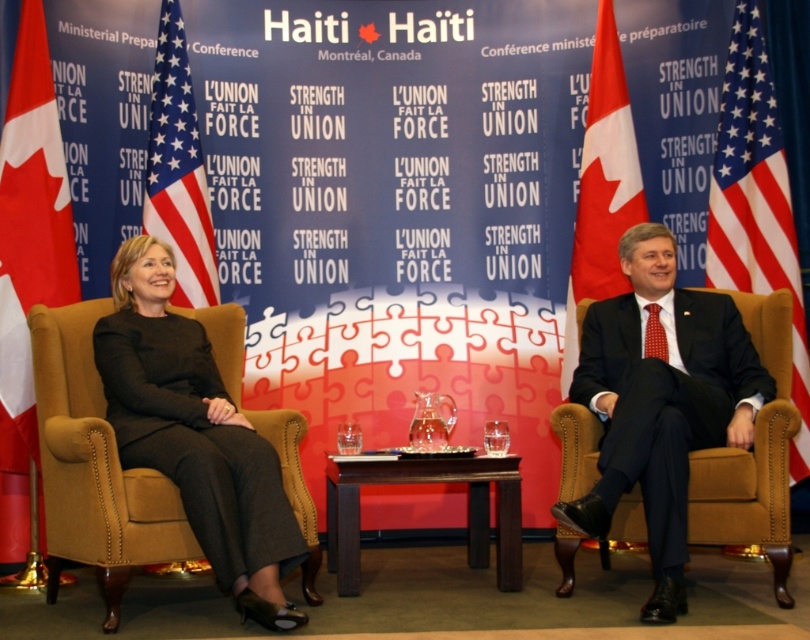
You are a photographer positioned at the back of the room. You want to capture a closeup shot of the red fabric flag at left without including the seated individuals in the frame. Given that your camera has a minimum focusing distance of 3 meters, can you adjust your position to achieve this?

The red fabric flag at left is 3.74 meters away from the camera. Since the minimum focusing distance is 3 meters, you can move closer to the flag to within 3 meters to take the closeup shot while excluding the seated individuals.

You are a photographer setting up for a formal event. You need to ensure that the black fabric dress at left and the american flag at right are both visible in the frame. Based on their positions, which object should you focus on first to ensure both are in focus?

The black fabric dress at left is in front of the american flag at right, so you should focus on the black fabric dress at left first to ensure both are in focus.

You are attending a diplomatic event and notice two items of interest in the scene. The black fabric dress at left and the american flag at right. Which one is located to the left of the other?

The black fabric dress at left is positioned on the left side of the american flag at right.